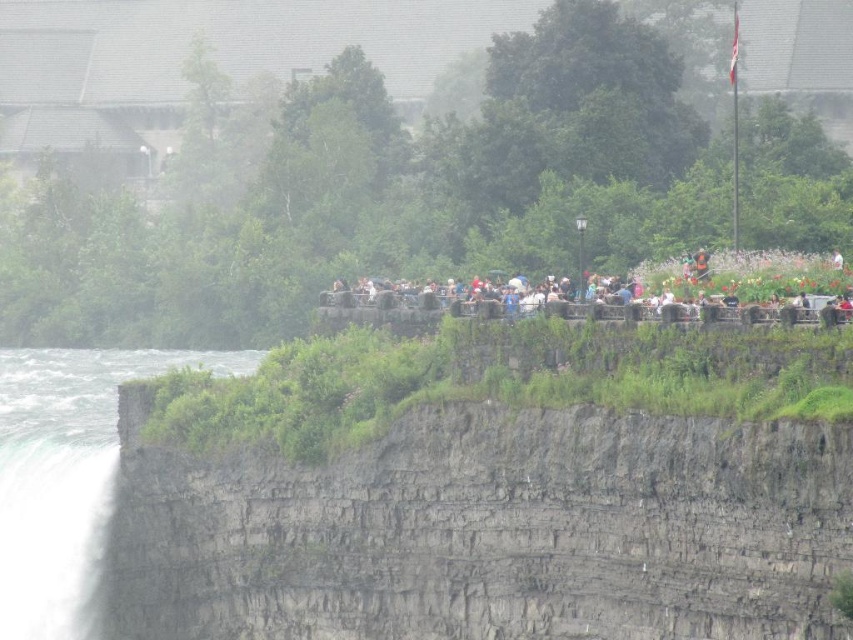
You are a photographer standing on the paved walkway at the scenic waterfall location. You want to capture a photo of the white misty waterfall at lower left and the matte black people at center in the same frame. Based on their positions, will the waterfall appear in the foreground or background of the people?

The white misty waterfall at lower left is located below matte black people at center, so it will appear in the background behind the people.

You are a photographer planning to capture the white frothy water at lower left and the white misty waterfall at lower left in a single frame. Based on their heights, which one should you focus on to ensure both are visible without cropping?

Since the white frothy water at lower left is taller than the white misty waterfall at lower left, you should focus on the white frothy water at lower left to ensure both are visible without cropping.

You are a tour guide leading a group to the white misty waterfall at lower left. Your group is currently standing at the matte black people at center. Can your group safely walk to the waterfall if the path is 13 meters long?

The distance between the white misty waterfall at lower left and the matte black people at center is 13.65 meters. Since the path is 13 meters long, the group cannot reach the waterfall as the path is shorter than the required distance.